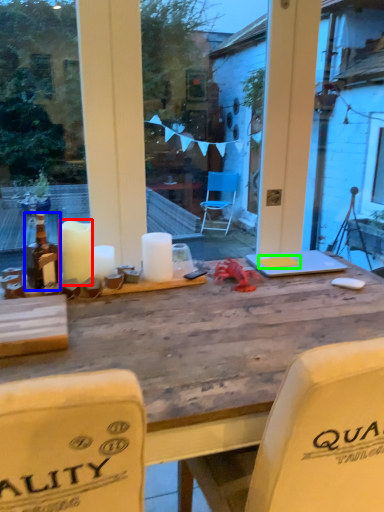
Question: Considering the real-world distances, which object is farthest from candle (highlighted by a red box)? bottle (highlighted by a blue box) or notepad (highlighted by a green box)?

Choices:
 (A) bottle
 (B) notepad

Answer: (B)